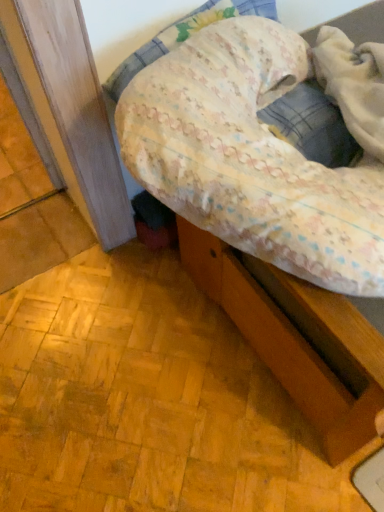
At what (x,y) coordinates should I click in order to perform the action: click on wooden bed at lower right. Please return your answer as a coordinate pair (x, y). Image resolution: width=384 pixels, height=512 pixels. Looking at the image, I should click on (297, 338).

This screenshot has height=512, width=384. What do you see at coordinates (297, 338) in the screenshot? I see `wooden bed at lower right` at bounding box center [297, 338].

What is the approximate width of wooden bed at lower right?

wooden bed at lower right is 24.94 inches in width.

Image resolution: width=384 pixels, height=512 pixels. I want to click on wooden bed at lower right, so click(297, 338).